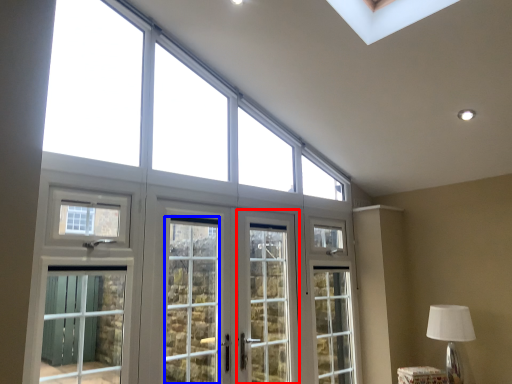
Question: Which of the following is the closest to the observer, screen door (highlighted by a red box) or screen door (highlighted by a blue box)?

Choices:
 (A) screen door
 (B) screen door

Answer: (B)